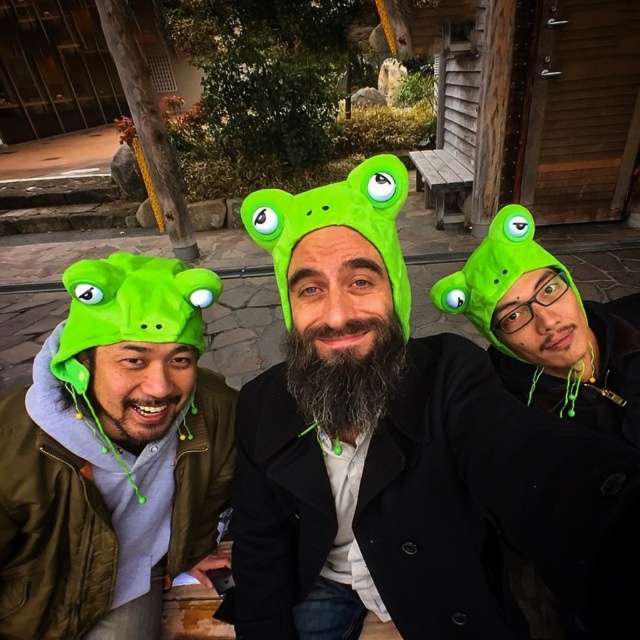
Can you confirm if green matte frog hat at center is positioned to the left of matte green frog hat at left?

Incorrect, green matte frog hat at center is not on the left side of matte green frog hat at left.

Is point (384, 340) less distant than point (97, 333)?

Yes, it is.

At what (x,y) coordinates should I click in order to perform the action: click on green matte frog hat at center. Please return your answer as a coordinate pair (x, y). The height and width of the screenshot is (640, 640). Looking at the image, I should click on (404, 454).

Which is more to the right, green matte frog hat at center or green matte frog hat at left?

green matte frog hat at center

Is green matte frog hat at center positioned at the back of green matte frog hat at left?

That is False.

Which is in front, point (426, 577) or point (173, 531)?

Positioned in front is point (426, 577).

Locate an element on the screen. The image size is (640, 640). green matte frog hat at center is located at coordinates (404, 454).

Who is taller, green matte frog hat at left or matte green frog hat at left?

Standing taller between the two is green matte frog hat at left.

Describe the element at coordinates (112, 451) in the screenshot. I see `green matte frog hat at left` at that location.

Image resolution: width=640 pixels, height=640 pixels. I want to click on green matte frog hat at left, so click(x=112, y=451).